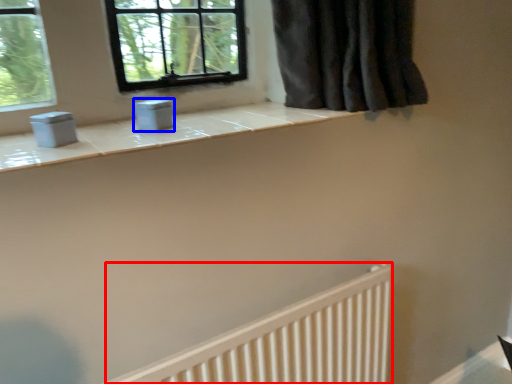
Question: Among these objects, which one is nearest to the camera, radiator (highlighted by a red box) or gray (highlighted by a blue box)?

Choices:
 (A) radiator
 (B) gray

Answer: (A)